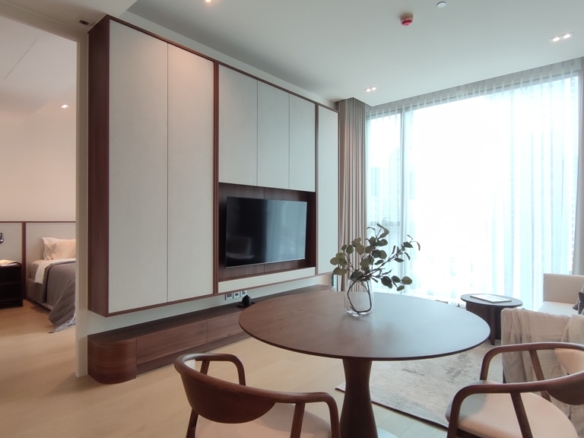
You are a GUI agent. You are given a task and a screenshot of the screen. Output one action in this format:
    pyautogui.click(x=<x>, y=<y>)
    Task: Click on the pillow
    
    Given the screenshot: What is the action you would take?
    pyautogui.click(x=57, y=248)